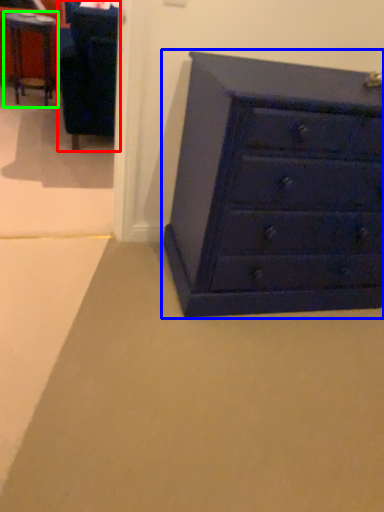
Question: Which object is the farthest from furniture (highlighted by a red box)? Choose among these: chest of drawers (highlighted by a blue box) or table (highlighted by a green box).

Choices:
 (A) chest of drawers
 (B) table

Answer: (A)